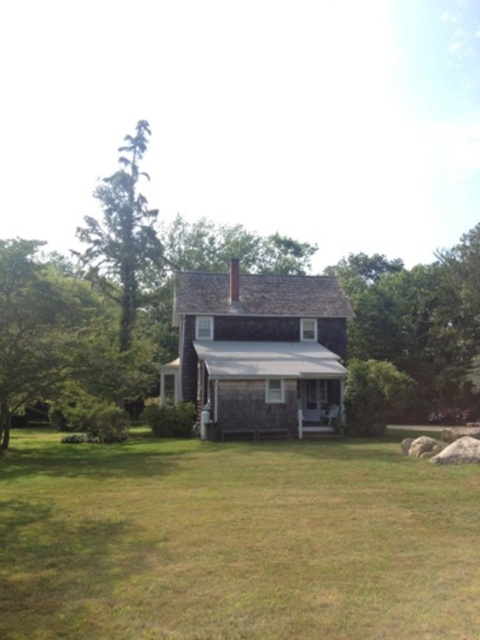
Can you confirm if green leafy tree at left is positioned to the left of green textured tree at left?

Incorrect, green leafy tree at left is not on the left side of green textured tree at left.

Does green leafy tree at left appear under green textured tree at left?

Correct, green leafy tree at left is located below green textured tree at left.

This screenshot has height=640, width=480. Identify the location of green leafy tree at left. 57,333.

You are a GUI agent. You are given a task and a screenshot of the screen. Output one action in this format:
    pyautogui.click(x=<x>, y=<y>)
    Task: Click on the green leafy tree at left
    The image size is (480, 640).
    Given the screenshot: What is the action you would take?
    pyautogui.click(x=57, y=333)